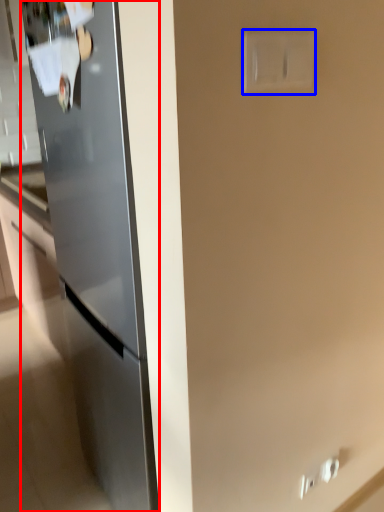
Question: Which object appears farthest to the camera in this image, refrigerator (highlighted by a red box) or electric outlet (highlighted by a blue box)?

Choices:
 (A) refrigerator
 (B) electric outlet

Answer: (A)